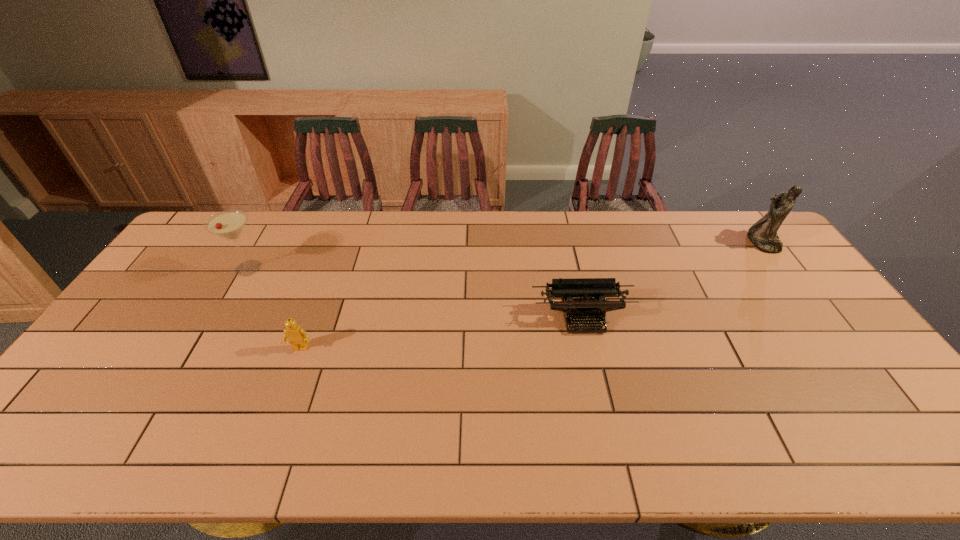
Where is `vacant space at the near right corner of the desktop`? The height and width of the screenshot is (540, 960). vacant space at the near right corner of the desktop is located at coordinates (878, 438).

This screenshot has height=540, width=960. I want to click on empty space that is in between the second object from left to right and the second tallest object, so click(275, 308).

This screenshot has height=540, width=960. Find the location of `vacant area that lies between the third object from left to right and the leftmost object`. vacant area that lies between the third object from left to right and the leftmost object is located at coordinates (416, 293).

Locate an element on the screen. unoccupied area between the rightmost object and the second farthest object is located at coordinates tap(505, 255).

Image resolution: width=960 pixels, height=540 pixels. I want to click on blank region between the typewriter and the third shortest object, so click(x=416, y=293).

Where is `free spot between the rightmost object and the second object from left to right`? free spot between the rightmost object and the second object from left to right is located at coordinates (531, 295).

At what (x,y) coordinates should I click in order to perform the action: click on vacant region between the nearest object and the typewriter. Please return your answer as a coordinate pair (x, y). Looking at the image, I should click on (442, 333).

Find the location of `free space between the third farthest object and the farthest object`. free space between the third farthest object and the farthest object is located at coordinates (672, 280).

Identify the location of free spot between the Lego and the second nearest object. This screenshot has height=540, width=960. (442, 333).

The image size is (960, 540). What are the coordinates of `free space that is in between the typewriter and the figurine` in the screenshot? It's located at (672, 280).